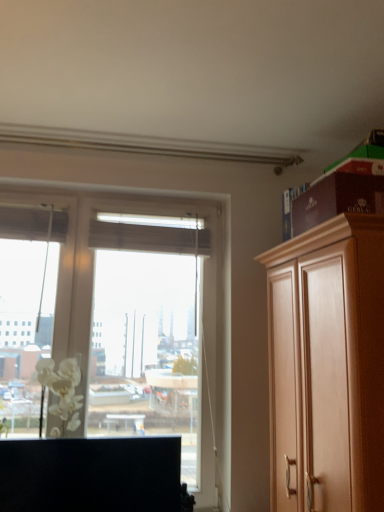
This screenshot has height=512, width=384. What do you see at coordinates (327, 366) in the screenshot?
I see `wooden cabinet at right, the 1th cabinetry positioned from the right` at bounding box center [327, 366].

This screenshot has height=512, width=384. What do you see at coordinates (62, 392) in the screenshot?
I see `white matte flower at left` at bounding box center [62, 392].

This screenshot has height=512, width=384. What are the coordinates of `wooden cabinet at right, the 1th cabinetry positioned from the right` in the screenshot? It's located at (327, 366).

Can you tell me how much black matte cabinet at lower left, which is counted as the second cabinetry, starting from the right, and wooden cabinet at right, which is the second cabinetry in left-to-right order, differ in facing direction?

The angular difference between black matte cabinet at lower left, which is counted as the second cabinetry, starting from the right, and wooden cabinet at right, which is the second cabinetry in left-to-right order, is 93.3 degrees.

Could you tell me if black matte cabinet at lower left, which is counted as the second cabinetry, starting from the right, is facing wooden cabinet at right, the 1th cabinetry positioned from the right?

No, black matte cabinet at lower left, which is counted as the second cabinetry, starting from the right, does not turn towards wooden cabinet at right, the 1th cabinetry positioned from the right.

Would you say black matte cabinet at lower left, marked as the first cabinetry in a left-to-right arrangement, is to the left or to the right of wooden cabinet at right, the 1th cabinetry positioned from the right, in the picture?

black matte cabinet at lower left, marked as the first cabinetry in a left-to-right arrangement, is positioned on wooden cabinet at right, the 1th cabinetry positioned from the right,'s left side.

From the image's perspective, which one is positioned lower, white matte flower at left or wooden cabinet at right, which is the second cabinetry in left-to-right order?

white matte flower at left.

Is white matte flower at left beside wooden cabinet at right, the 1th cabinetry positioned from the right?

There is a gap between white matte flower at left and wooden cabinet at right, the 1th cabinetry positioned from the right.

Considering the relative sizes of white matte flower at left and wooden cabinet at right, which is the second cabinetry in left-to-right order, in the image provided, is white matte flower at left wider than wooden cabinet at right, which is the second cabinetry in left-to-right order,?

No, white matte flower at left is not wider than wooden cabinet at right, which is the second cabinetry in left-to-right order.

Is wooden cabinet at right, which is the second cabinetry in left-to-right order, inside white matte flower at left?

Actually, wooden cabinet at right, which is the second cabinetry in left-to-right order, is outside white matte flower at left.

From the picture: Is wooden cabinet at right, which is the second cabinetry in left-to-right order, to the left of black matte cabinet at lower left, which is counted as the second cabinetry, starting from the right, from the viewer's perspective?

No, wooden cabinet at right, which is the second cabinetry in left-to-right order, is not to the left of black matte cabinet at lower left, which is counted as the second cabinetry, starting from the right.

From the image's perspective, is wooden cabinet at right, which is the second cabinetry in left-to-right order, positioned above or below black matte cabinet at lower left, marked as the first cabinetry in a left-to-right arrangement?

wooden cabinet at right, which is the second cabinetry in left-to-right order, is situated higher than black matte cabinet at lower left, marked as the first cabinetry in a left-to-right arrangement, in the image.

Which object is thinner, wooden cabinet at right, which is the second cabinetry in left-to-right order, or black matte cabinet at lower left, marked as the first cabinetry in a left-to-right arrangement?

black matte cabinet at lower left, marked as the first cabinetry in a left-to-right arrangement, is thinner.

Is wooden cabinet at right, which is the second cabinetry in left-to-right order, next to black matte cabinet at lower left, which is counted as the second cabinetry, starting from the right?

wooden cabinet at right, which is the second cabinetry in left-to-right order, and black matte cabinet at lower left, which is counted as the second cabinetry, starting from the right, are clearly separated.

Can you confirm if white matte flower at left is thinner than black matte cabinet at lower left, marked as the first cabinetry in a left-to-right arrangement?

No.

Does white matte flower at left have a larger size compared to black matte cabinet at lower left, which is counted as the second cabinetry, starting from the right?

No, white matte flower at left is not bigger than black matte cabinet at lower left, which is counted as the second cabinetry, starting from the right.

Is white matte flower at left positioned far away from black matte cabinet at lower left, marked as the first cabinetry in a left-to-right arrangement?

white matte flower at left is actually quite close to black matte cabinet at lower left, marked as the first cabinetry in a left-to-right arrangement.

Is wooden cabinet at right, the 1th cabinetry positioned from the right, inside the boundaries of white matte flower at left, or outside?

wooden cabinet at right, the 1th cabinetry positioned from the right, is not inside white matte flower at left, it's outside.

Find the location of `cabinetry above the white matte flower at left (from the image's perspective)`. cabinetry above the white matte flower at left (from the image's perspective) is located at coordinates click(x=327, y=366).

Is wooden cabinet at right, the 1th cabinetry positioned from the right, placed right next to white matte flower at left?

No, wooden cabinet at right, the 1th cabinetry positioned from the right, is not next to white matte flower at left.

Find the location of a particular element. The height and width of the screenshot is (512, 384). flower to the left of black matte cabinet at lower left, which is counted as the second cabinetry, starting from the right is located at coordinates coord(62,392).

Considering the relative sizes of black matte cabinet at lower left, which is counted as the second cabinetry, starting from the right, and white matte flower at left in the image provided, is black matte cabinet at lower left, which is counted as the second cabinetry, starting from the right, thinner than white matte flower at left?

Correct, the width of black matte cabinet at lower left, which is counted as the second cabinetry, starting from the right, is less than that of white matte flower at left.

From the image's perspective, is black matte cabinet at lower left, marked as the first cabinetry in a left-to-right arrangement, below white matte flower at left?

Yes, from the image's perspective, black matte cabinet at lower left, marked as the first cabinetry in a left-to-right arrangement, is beneath white matte flower at left.

You are a GUI agent. You are given a task and a screenshot of the screen. Output one action in this format:
    pyautogui.click(x=<x>, y=<y>)
    Task: Click on the cabinetry above the black matte cabinet at lower left, marked as the first cabinetry in a left-to-right arrangement (from the image's perspective)
    
    Given the screenshot: What is the action you would take?
    pyautogui.click(x=327, y=366)

At what (x,y) coordinates should I click in order to perform the action: click on flower lying below the wooden cabinet at right, the 1th cabinetry positioned from the right (from the image's perspective). Please return your answer as a coordinate pair (x, y). The image size is (384, 512). Looking at the image, I should click on (62, 392).

When comparing their distances from black matte cabinet at lower left, marked as the first cabinetry in a left-to-right arrangement, does white matte flower at left or wooden cabinet at right, the 1th cabinetry positioned from the right, seem closer?

white matte flower at left is closer to black matte cabinet at lower left, marked as the first cabinetry in a left-to-right arrangement.

Based on their spatial positions, is wooden cabinet at right, which is the second cabinetry in left-to-right order, or white matte flower at left further from black matte cabinet at lower left, marked as the first cabinetry in a left-to-right arrangement?

wooden cabinet at right, which is the second cabinetry in left-to-right order.

Which object lies further to the anchor point white matte flower at left, black matte cabinet at lower left, which is counted as the second cabinetry, starting from the right, or wooden cabinet at right, the 1th cabinetry positioned from the right?

wooden cabinet at right, the 1th cabinetry positioned from the right.

Considering their positions, is white matte flower at left positioned closer to wooden cabinet at right, the 1th cabinetry positioned from the right, than black matte cabinet at lower left, which is counted as the second cabinetry, starting from the right?

Among the two, black matte cabinet at lower left, which is counted as the second cabinetry, starting from the right, is located nearer to wooden cabinet at right, the 1th cabinetry positioned from the right.

Looking at the image, which one is located further to wooden cabinet at right, the 1th cabinetry positioned from the right, black matte cabinet at lower left, which is counted as the second cabinetry, starting from the right, or white matte flower at left?

The object further to wooden cabinet at right, the 1th cabinetry positioned from the right, is white matte flower at left.

Which object lies nearer to the anchor point white matte flower at left, wooden cabinet at right, the 1th cabinetry positioned from the right, or black matte cabinet at lower left, which is counted as the second cabinetry, starting from the right?

Among the two, black matte cabinet at lower left, which is counted as the second cabinetry, starting from the right, is located nearer to white matte flower at left.

The width and height of the screenshot is (384, 512). Find the location of `cabinetry located between white matte flower at left and wooden cabinet at right, the 1th cabinetry positioned from the right, in the left-right direction`. cabinetry located between white matte flower at left and wooden cabinet at right, the 1th cabinetry positioned from the right, in the left-right direction is located at coordinates (91, 475).